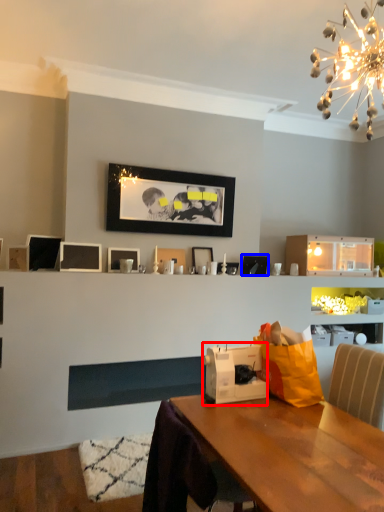
Question: Which of the following is the farthest to the observer, appliance (highlighted by a red box) or picture frame (highlighted by a blue box)?

Choices:
 (A) appliance
 (B) picture frame

Answer: (B)